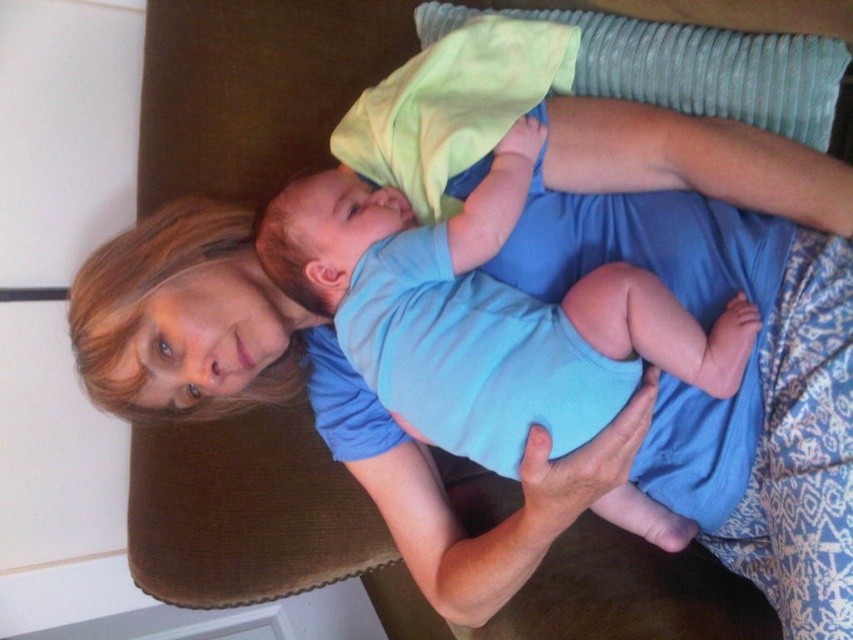
Which is above, blue cotton onesie at center or textured gray pillow at upper center?

textured gray pillow at upper center

Measure the distance between blue cotton onesie at center and textured gray pillow at upper center.

They are 12.88 inches apart.

You are a GUI agent. You are given a task and a screenshot of the screen. Output one action in this format:
    pyautogui.click(x=<x>, y=<y>)
    Task: Click on the blue cotton onesie at center
    The width and height of the screenshot is (853, 640).
    Given the screenshot: What is the action you would take?
    click(x=483, y=314)